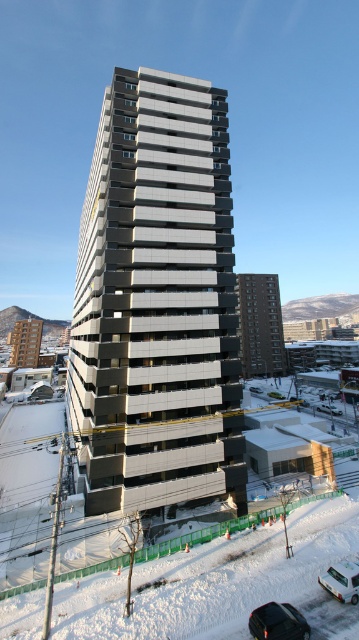
Can you confirm if white powdery snow at lower center is positioned above black glossy car at lower center?

No, white powdery snow at lower center is not above black glossy car at lower center.

Is point (211, 572) behind point (305, 628)?

Yes, point (211, 572) is behind point (305, 628).

Identify the location of white powdery snow at lower center. The height and width of the screenshot is (640, 359). (218, 582).

Who is higher up, black glossy car at lower center or white matte car at lower right?

Answer: white matte car at lower right

The image size is (359, 640). Find the location of `black glossy car at lower center`. black glossy car at lower center is located at coordinates (277, 621).

Who is positioned more to the right, white powdery snow at lower center or white matte car at lower right?

From the viewer's perspective, white matte car at lower right appears more on the right side.

Measure the distance between white powdery snow at lower center and camera.

A distance of 77.52 feet exists between white powdery snow at lower center and camera.

Who is more forward, [252,580] or [333,577]?

Point [333,577]

Image resolution: width=359 pixels, height=640 pixels. Find the location of `white powdery snow at lower center`. white powdery snow at lower center is located at coordinates (218, 582).